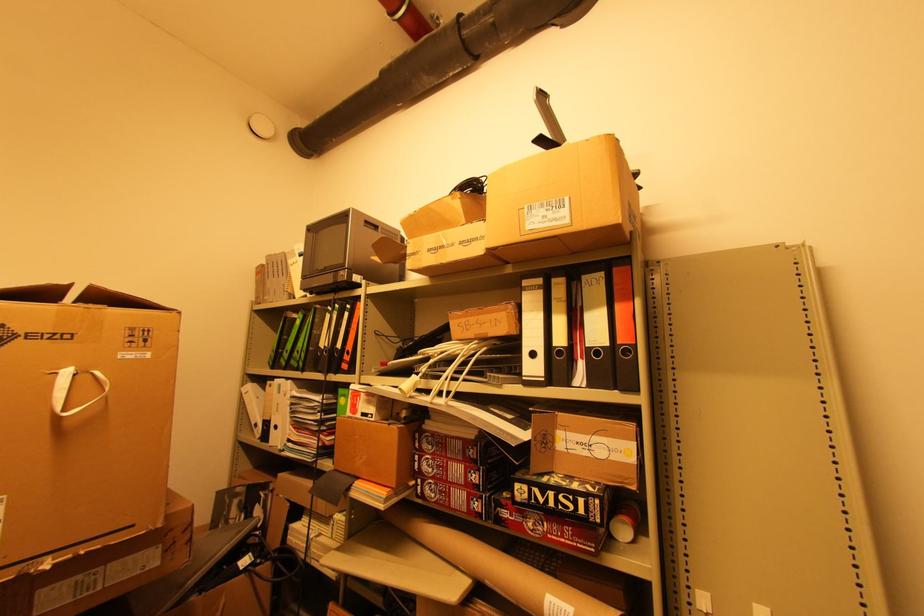
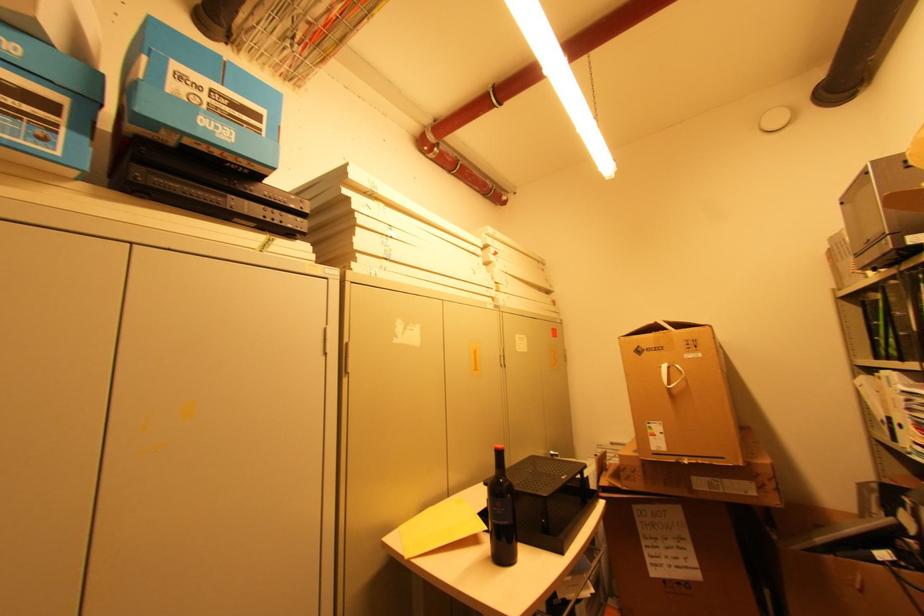
The point at (286, 353) is marked in the first image. Where is the corresponding point in the second image?

(881, 341)